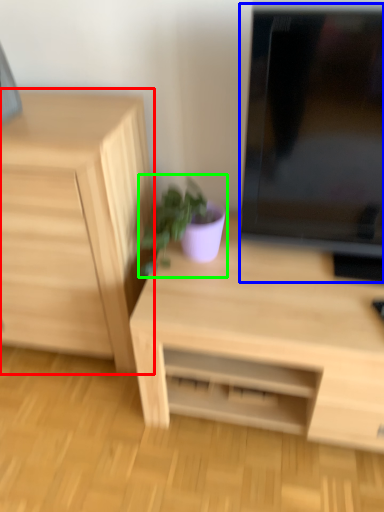
Question: Considering the real-world distances, which object is farthest from chest of drawers (highlighted by a red box)? computer monitor (highlighted by a blue box) or houseplant (highlighted by a green box)?

Choices:
 (A) computer monitor
 (B) houseplant

Answer: (A)